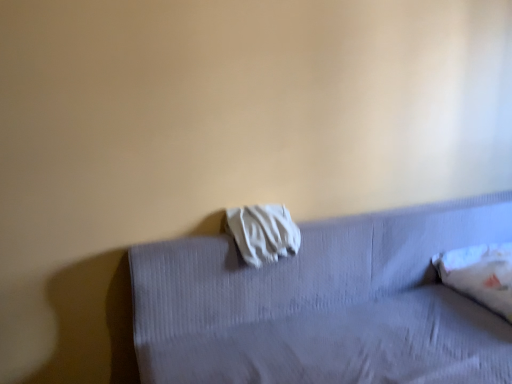
Question: Is white fabric at center inside or outside of white fabric at upper center?

Choices:
 (A) outside
 (B) inside

Answer: (B)

Question: Is point (246, 211) positioned closer to the camera than point (246, 286)?

Choices:
 (A) closer
 (B) farther

Answer: (B)

Question: Which is farther from the white fabric at center?

Choices:
 (A) white fabric at upper center
 (B) white soft pillow at right

Answer: (B)

Question: Which is nearer to the white fabric at upper center?

Choices:
 (A) white soft pillow at right
 (B) white fabric at center

Answer: (B)